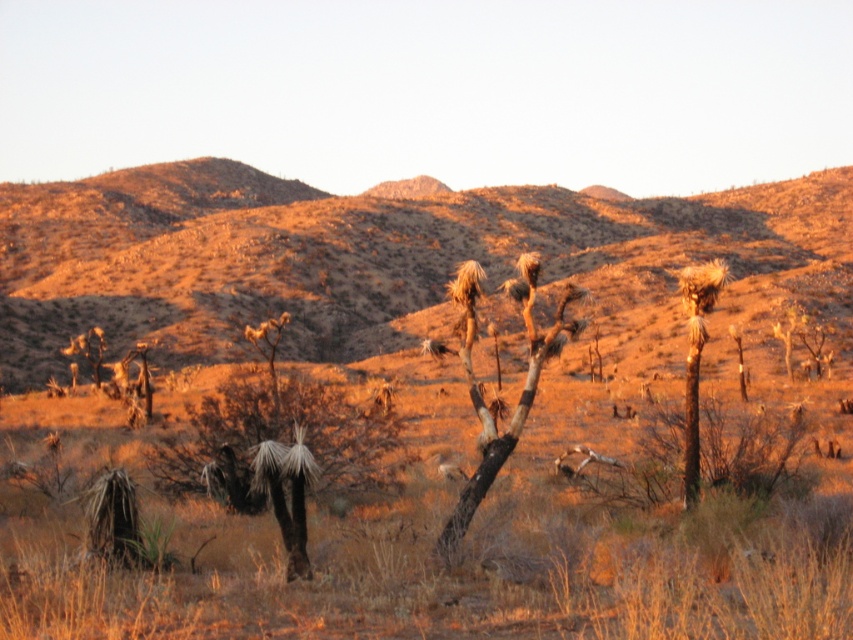
Based on the photo, you are a desert explorer who needs to determine which tree takes up more space in the image. You see the brown woody tree at center and the brown rough bark tree at center. Which one has a larger area in the image?

The brown rough bark tree at center has a larger area in the image than the brown woody tree at center because the brown woody tree at center occupies less space than brown rough bark tree at center.